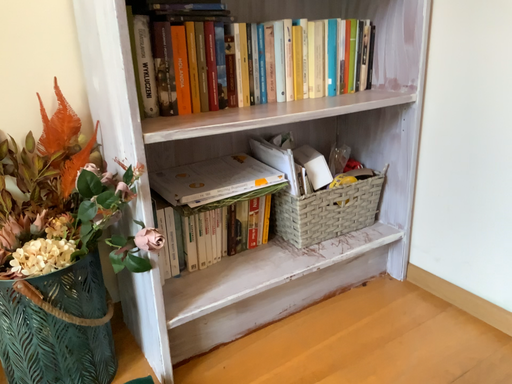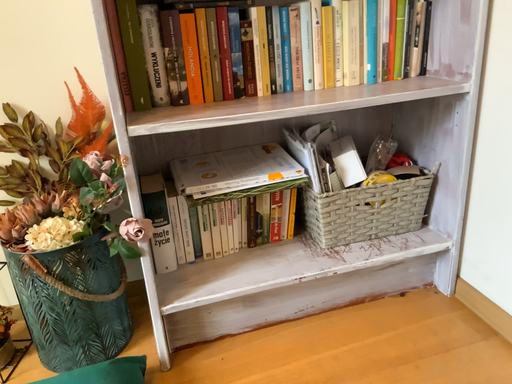
Question: How did the camera likely rotate when shooting the video?

Choices:
 (A) rotated left
 (B) rotated right

Answer: (A)